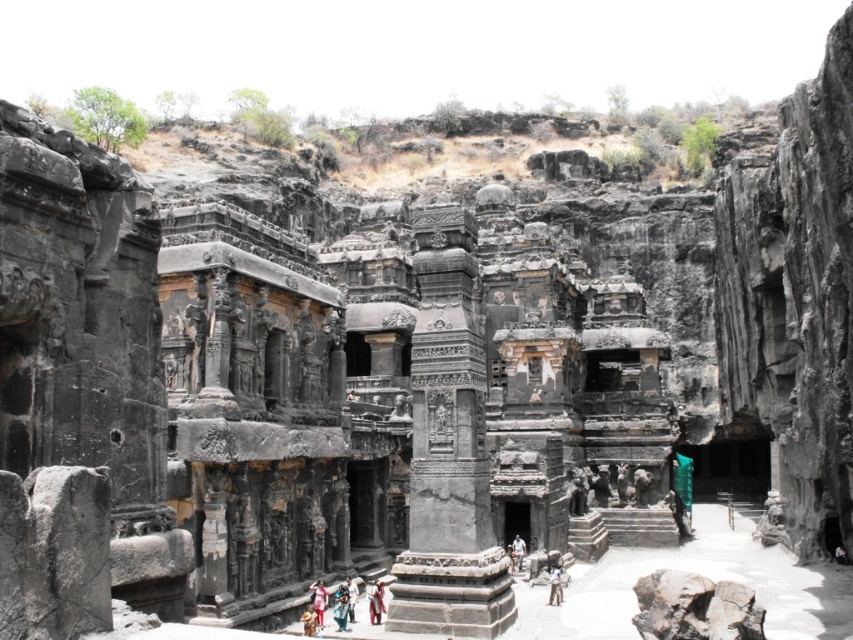
You are standing at the point marked as point [345,589] in the Ellora Caves. You want to take a photo of the central column with your camera, which has a maximum zoom range of 100 meters. Can you capture the central column in your photo without moving closer?

The distance between you and the central column is 70.85 meters, which is within the camera maximum zoom range of 100 meters. Therefore, you can capture the central column in your photo without moving closer.

Looking at this image, you are standing in front of the Ellora Caves and see the light brown leather jacket at center and the light brown fabric person at center. Which object is positioned closer to you?

The light brown leather jacket at center is closer to the viewer than the light brown fabric person at center.

You are a tour guide leading a group at the Ellora Caves. You notice two fabric figures dressed in traditional attire near the central column. Which of the two, the blue fabric person at center or the light brown fabric person at center, is taller?

The light brown fabric person at center is taller than the blue fabric person at center.